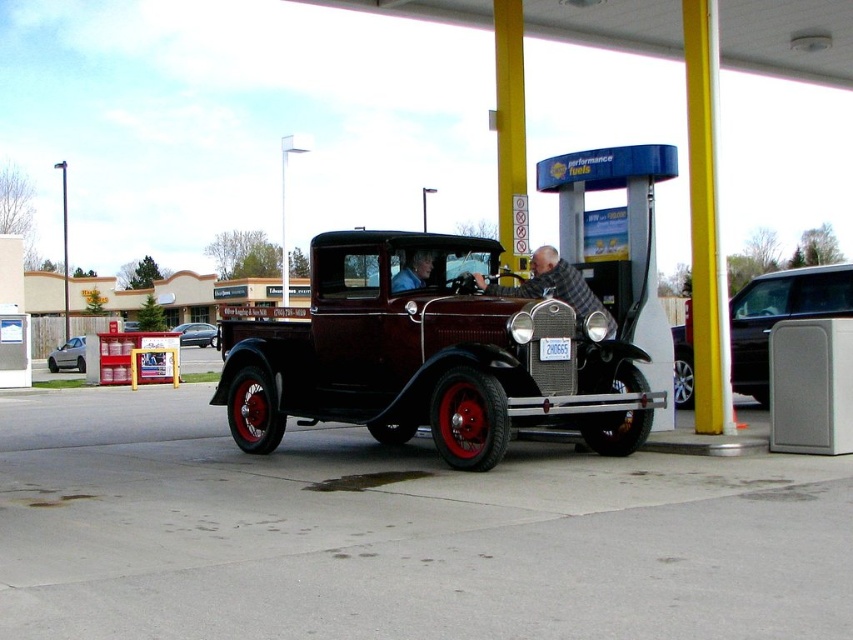
Looking at this image, does plaid wool sweater at center appear over silver metallic hatchback at left?

Indeed, plaid wool sweater at center is positioned over silver metallic hatchback at left.

Which of these two, plaid wool sweater at center or silver metallic hatchback at left, stands shorter?

plaid wool sweater at center

Is point (532, 259) closer to camera compared to point (55, 353)?

Yes, point (532, 259) is in front of point (55, 353).

The image size is (853, 640). What are the coordinates of `plaid wool sweater at center` in the screenshot? It's located at pos(553,285).

Is metallic silver van at right above matte black shirt at center?

Incorrect, metallic silver van at right is not positioned above matte black shirt at center.

The height and width of the screenshot is (640, 853). What do you see at coordinates (780, 316) in the screenshot? I see `metallic silver van at right` at bounding box center [780, 316].

The width and height of the screenshot is (853, 640). I want to click on metallic silver van at right, so click(x=780, y=316).

Between plaid wool sweater at center and matte black shirt at center, which one has more height?

Standing taller between the two is plaid wool sweater at center.

Can you confirm if plaid wool sweater at center is positioned to the right of matte black shirt at center?

Indeed, plaid wool sweater at center is positioned on the right side of matte black shirt at center.

Is point (583, 284) positioned before point (399, 273)?

No, it is behind (399, 273).

Locate an element on the screen. plaid wool sweater at center is located at coordinates (553, 285).